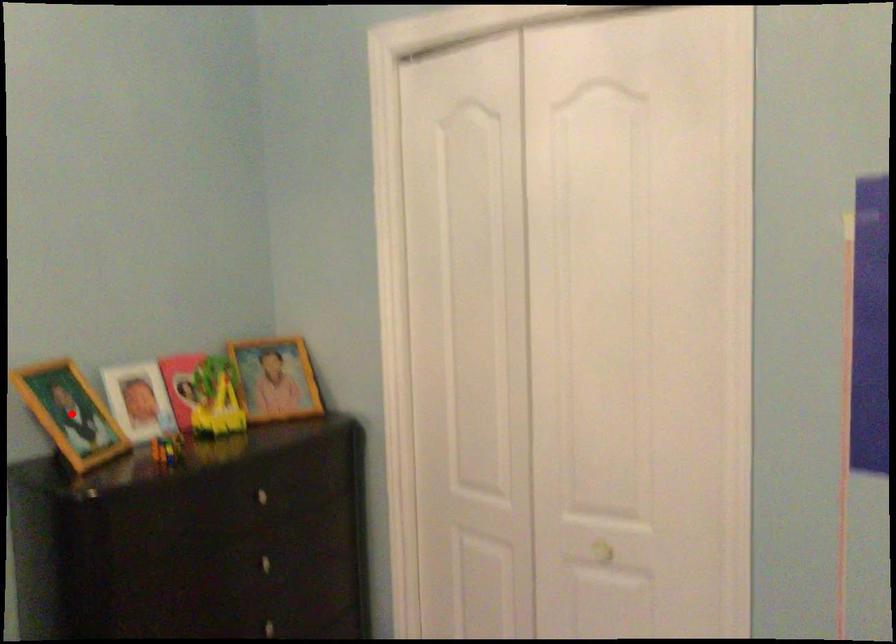
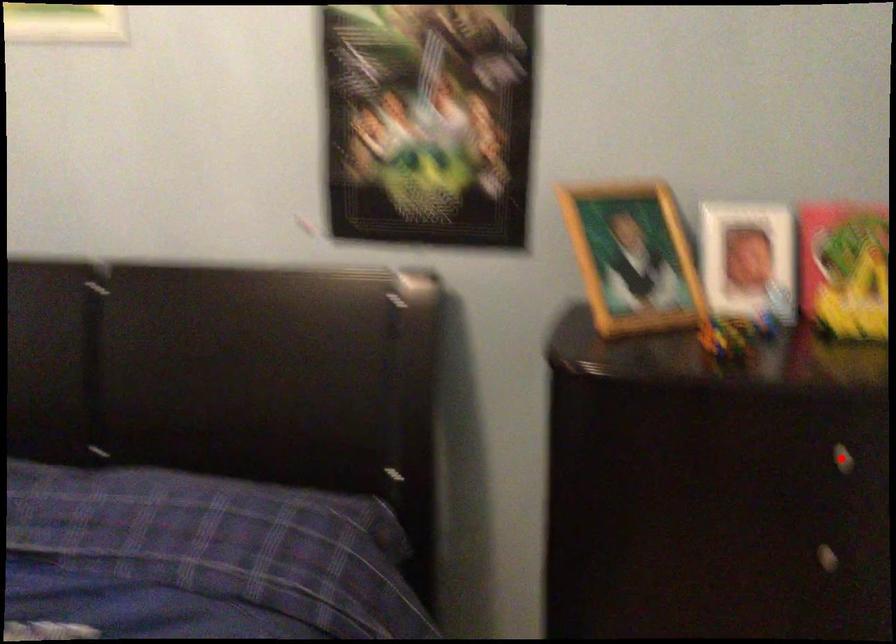
I am providing you with two images of the same scene from different viewpoints. A red point is marked on the first image and another point is marked on the second image. Is the marked point in image1 the same physical position as the marked point in image2?

No